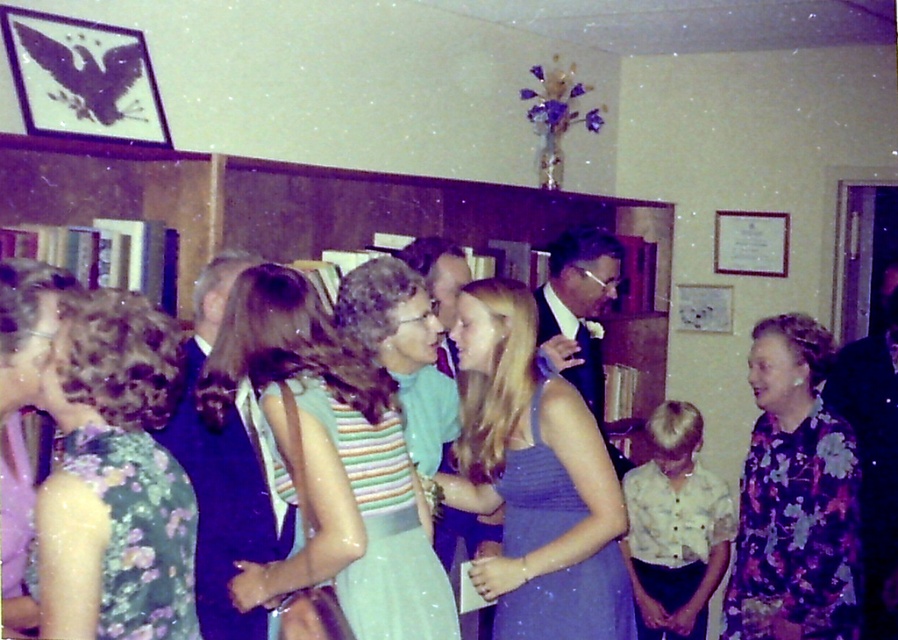
You are a photographer at the event and want to capture a photo of the green satin dress at center. The camera you are using has a focal length of 50mm and an aperture of f2.8. The dress is at point 0.823, 0.427 in the image coordinate system. To ensure the dress is in focus, where should you adjust the focus point of your camera?

The focus point should be set to (383, 525) to ensure the green satin dress at center is in focus.

Looking at this image, you are a photographer at a formal event. You notice two guests wearing dresses with floral patterns. One is a floral fabric dress at left and the other is a floral print dress at right. Based on their positions and the scene description, which dress is positioned higher in the image?

The floral fabric dress at left is positioned higher in the image than the floral print dress at right.

You are a photographer at a formal event and need to arrange two dresses for a photo shoot. The green satin dress at center and the matte blue dress at center are already placed in the scene. Which dress is to the right of the other?

The green satin dress at center is positioned on the right side of matte blue dress at center.